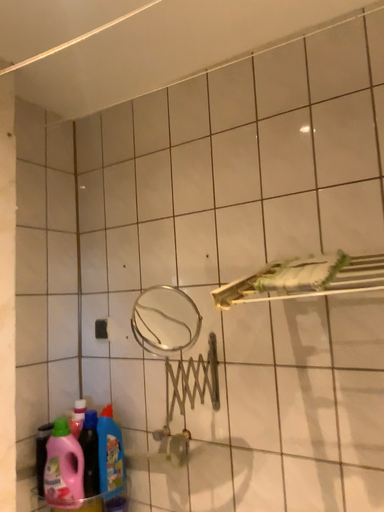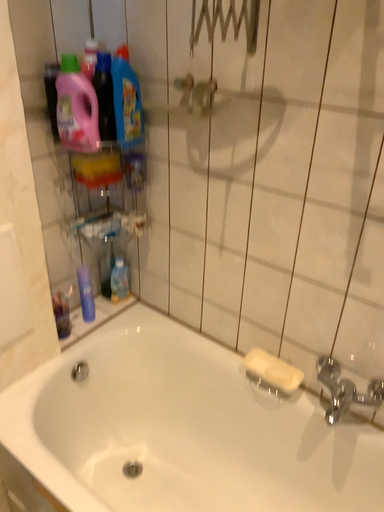
Question: How did the camera likely rotate when shooting the video?

Choices:
 (A) rotated downward
 (B) rotated upward

Answer: (A)